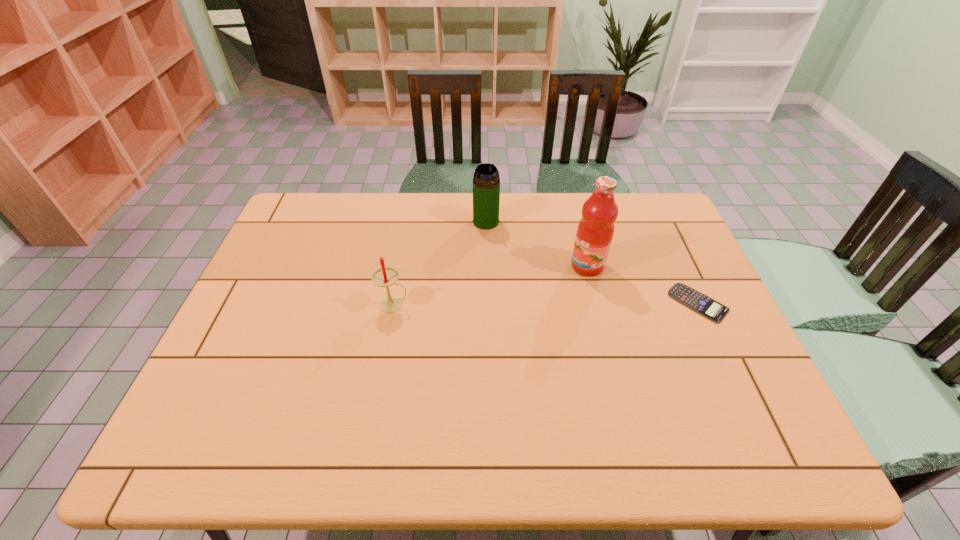
In the image, there is a desktop. Where is `vacant space at the left edge`? vacant space at the left edge is located at coordinates (272, 294).

This screenshot has height=540, width=960. I want to click on free space at the right edge, so click(667, 320).

In the image, there is a desktop. Where is `vacant region at the near left corner`? The height and width of the screenshot is (540, 960). vacant region at the near left corner is located at coordinates (260, 397).

Image resolution: width=960 pixels, height=540 pixels. I want to click on empty location between the shortest object and the leftmost object, so click(x=546, y=303).

The width and height of the screenshot is (960, 540). I want to click on vacant region between the tallest object and the calculator, so click(643, 285).

The width and height of the screenshot is (960, 540). In order to click on vacant point located between the rightmost object and the leftmost object in this screenshot , I will do `click(546, 303)`.

Where is `vacant region between the thermos bottle and the candle`? The width and height of the screenshot is (960, 540). vacant region between the thermos bottle and the candle is located at coordinates (440, 263).

Identify the location of vacant region between the candle and the rightmost object. This screenshot has height=540, width=960. (546, 303).

Find the location of a particular element. The image size is (960, 540). free space that is in between the second object from right to left and the calculator is located at coordinates (643, 285).

Where is `unoccupied area between the tallest object and the third object from right to left`? This screenshot has height=540, width=960. unoccupied area between the tallest object and the third object from right to left is located at coordinates (537, 244).